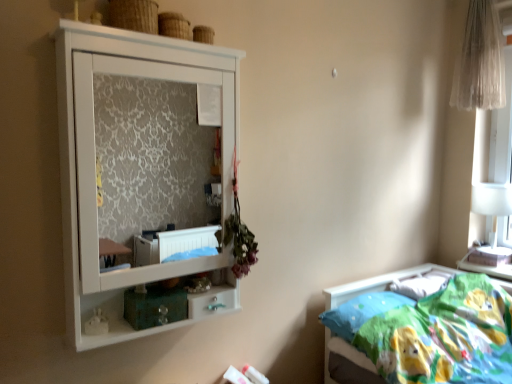
Question: Can you confirm if white matte cupboard at upper left is taller than blue fabric pillow at lower right?

Choices:
 (A) yes
 (B) no

Answer: (A)

Question: Is white matte cupboard at upper left bigger than blue fabric pillow at lower right?

Choices:
 (A) yes
 (B) no

Answer: (A)

Question: Are white matte cupboard at upper left and blue fabric pillow at lower right making contact?

Choices:
 (A) no
 (B) yes

Answer: (A)

Question: Is white matte cupboard at upper left further to the viewer compared to blue fabric pillow at lower right?

Choices:
 (A) no
 (B) yes

Answer: (A)

Question: From a real-world perspective, is white matte cupboard at upper left located beneath blue fabric pillow at lower right?

Choices:
 (A) no
 (B) yes

Answer: (A)

Question: Considering the relative positions of blue fabric pillow at lower right and white matte cupboard at upper left in the image provided, is blue fabric pillow at lower right to the left or to the right of white matte cupboard at upper left?

Choices:
 (A) right
 (B) left

Answer: (A)

Question: From a real-world perspective, relative to white matte cupboard at upper left, is blue fabric pillow at lower right vertically above or below?

Choices:
 (A) above
 (B) below

Answer: (B)

Question: In terms of height, does blue fabric pillow at lower right look taller or shorter compared to white matte cupboard at upper left?

Choices:
 (A) short
 (B) tall

Answer: (A)

Question: Is blue fabric pillow at lower right inside or outside of white matte cupboard at upper left?

Choices:
 (A) outside
 (B) inside

Answer: (A)

Question: From the image's perspective, is wooden textured basket at upper center above or below white matte cupboard at upper left?

Choices:
 (A) above
 (B) below

Answer: (A)

Question: Considering the positions of wooden textured basket at upper center and white matte cupboard at upper left in the image, is wooden textured basket at upper center taller or shorter than white matte cupboard at upper left?

Choices:
 (A) tall
 (B) short

Answer: (B)

Question: Does point (138, 31) appear closer or farther from the camera than point (61, 39)?

Choices:
 (A) closer
 (B) farther

Answer: (B)

Question: From a real-world perspective, relative to white matte cupboard at upper left, is wooden textured basket at upper center vertically above or below?

Choices:
 (A) below
 (B) above

Answer: (B)

Question: Considering the positions of white glossy table lamp at right and wooden textured basket at upper center in the image, is white glossy table lamp at right taller or shorter than wooden textured basket at upper center?

Choices:
 (A) short
 (B) tall

Answer: (B)

Question: From the image's perspective, is white glossy table lamp at right positioned above or below wooden textured basket at upper center?

Choices:
 (A) above
 (B) below

Answer: (B)